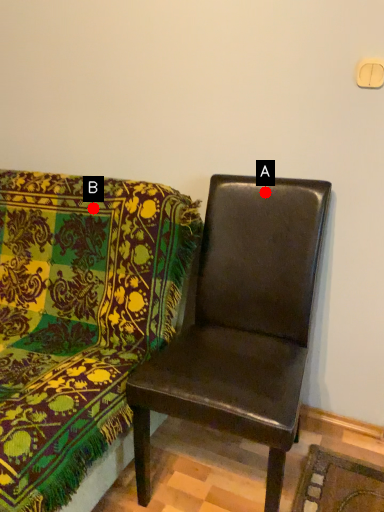
Question: Two points are circled on the image, labeled by A and B beside each circle. Among these points, which one is farthest from the camera?

Choices:
 (A) A is further
 (B) B is further

Answer: (B)